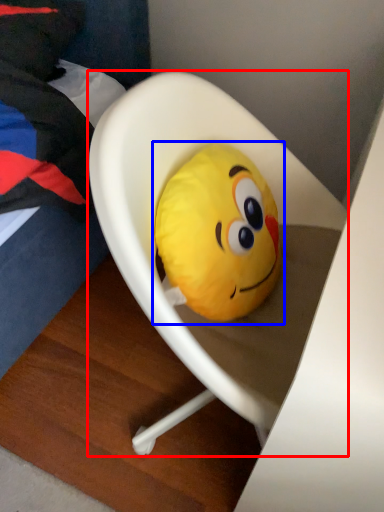
Question: Which of the following is the closest to the observer, furniture (highlighted by a red box) or toy (highlighted by a blue box)?

Choices:
 (A) furniture
 (B) toy

Answer: (A)